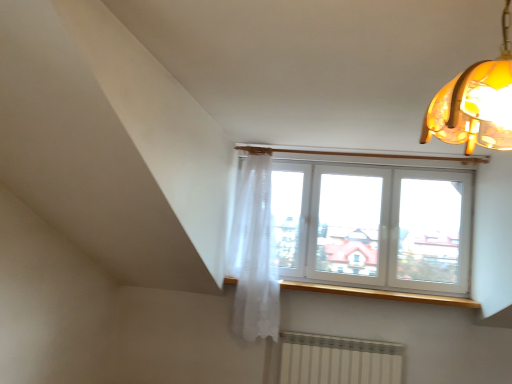
Question: Can you confirm if white sheer curtain at upper center is thinner than wooden at upper center?

Choices:
 (A) no
 (B) yes

Answer: (A)

Question: Could you tell me if white sheer curtain at upper center is turned towards wooden at upper center?

Choices:
 (A) no
 (B) yes

Answer: (A)

Question: Is white sheer curtain at upper center positioned behind wooden at upper center?

Choices:
 (A) no
 (B) yes

Answer: (A)

Question: From the image's perspective, is white sheer curtain at upper center located above wooden at upper center?

Choices:
 (A) yes
 (B) no

Answer: (A)

Question: Is white sheer curtain at upper center looking in the opposite direction of wooden at upper center?

Choices:
 (A) no
 (B) yes

Answer: (A)

Question: Are white sheer curtain at upper center and wooden at upper center far apart?

Choices:
 (A) yes
 (B) no

Answer: (B)

Question: From the image's perspective, is white sheer curtain at upper center on white plastic window at upper center?

Choices:
 (A) no
 (B) yes

Answer: (A)

Question: Is white plastic window at upper center a part of white sheer curtain at upper center?

Choices:
 (A) yes
 (B) no

Answer: (B)

Question: Does white sheer curtain at upper center turn towards white plastic window at upper center?

Choices:
 (A) yes
 (B) no

Answer: (B)

Question: From a real-world perspective, does white sheer curtain at upper center sit lower than white plastic window at upper center?

Choices:
 (A) yes
 (B) no

Answer: (A)

Question: Is white sheer curtain at upper center looking in the opposite direction of white plastic window at upper center?

Choices:
 (A) yes
 (B) no

Answer: (B)

Question: Is white sheer curtain at upper center thinner than white plastic window at upper center?

Choices:
 (A) yes
 (B) no

Answer: (B)

Question: Is translucent amber glass lampshade at upper right looking in the opposite direction of white plastic window at upper center?

Choices:
 (A) yes
 (B) no

Answer: (A)